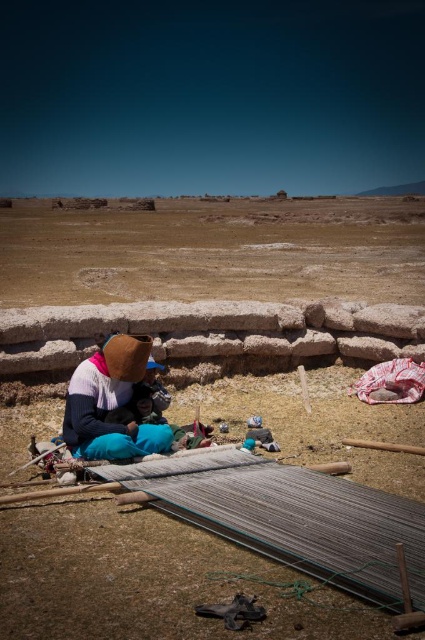
Between brown dry soil at center and brown woolen hat at center, which one is positioned higher?

brown dry soil at center is higher up.

Can you confirm if brown dry soil at center is wider than brown woolen hat at center?

Indeed, brown dry soil at center has a greater width compared to brown woolen hat at center.

Who is more forward, (x=27, y=234) or (x=127, y=392)?

Point (x=127, y=392) is more forward.

At what (x,y) coordinates should I click in order to perform the action: click on brown dry soil at center. Please return your answer as a coordinate pair (x, y). Image resolution: width=425 pixels, height=640 pixels. Looking at the image, I should click on (214, 252).